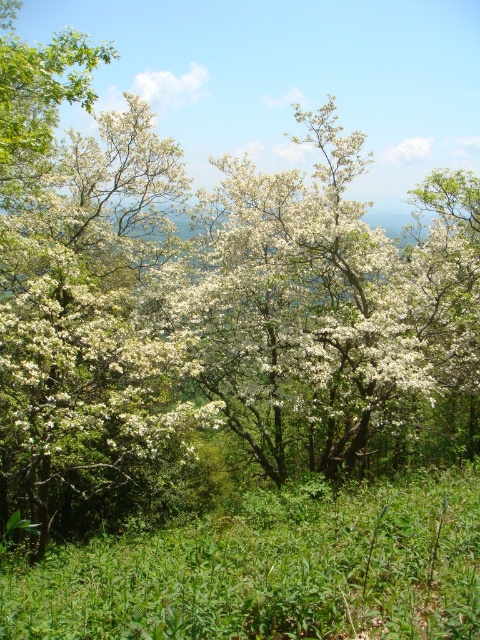
You are standing in the middle of the scene and want to pick up the green leafy grass at center. Can you reach it without moving the white matte flowers at center?

The green leafy grass at center is behind the white matte flowers at center, so you cannot reach it without moving the white matte flowers at center.

A hiker is standing at point A and wants to reach point B in the forest. The two points are marked as point A at coordinates (x=212, y=304) and point B at coordinates 0.623, 0.319. According to the map, the distance between these two points is 15.12 meters. If the hiker can walk at a speed of 1.5 meters per second, how long will it take them to travel from point A to point B?

The distance between point A at coordinates (x=212, y=304) and point B at coordinates 0.623, 0.319 is 15.12 meters. At a walking speed of 1.5 meters per second, the time required would be 15.12 divided by 1.5, which equals approximately 10.08 seconds. Therefore, it will take about 10.08 seconds for the hiker to travel from point A to point B.